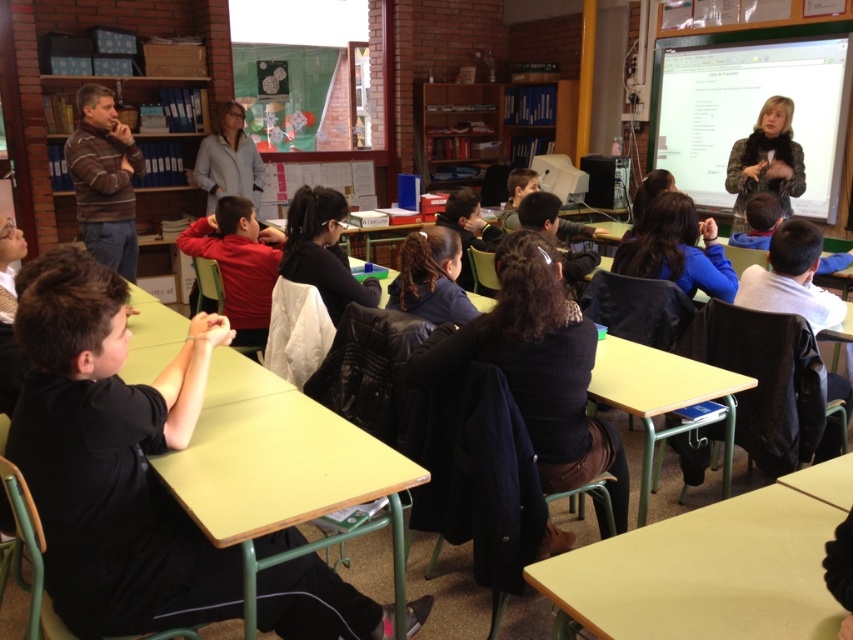
Question: Considering the real-world distances, which object is farthest from the wooden table at center?

Choices:
 (A) light blue jacket at upper center
 (B) black fabric shirt at center

Answer: (A)

Question: Can you confirm if light wood table at lower right is positioned to the right of wooden table at center?

Choices:
 (A) yes
 (B) no

Answer: (B)

Question: Observing the image, what is the correct spatial positioning of black fabric shirt at center in reference to green fabric bulletin board at upper right?

Choices:
 (A) right
 (B) left

Answer: (B)

Question: Which point is closer to the camera taking this photo?

Choices:
 (A) (671, 608)
 (B) (262, 616)

Answer: (A)

Question: Is striped sweater at left below light blue jacket at upper center?

Choices:
 (A) yes
 (B) no

Answer: (A)

Question: Considering the real-world distances, which object is closest to the light wood table at lower right?

Choices:
 (A) green fabric bulletin board at upper right
 (B) black fabric shirt at center
 (C) striped sweater at left

Answer: (B)